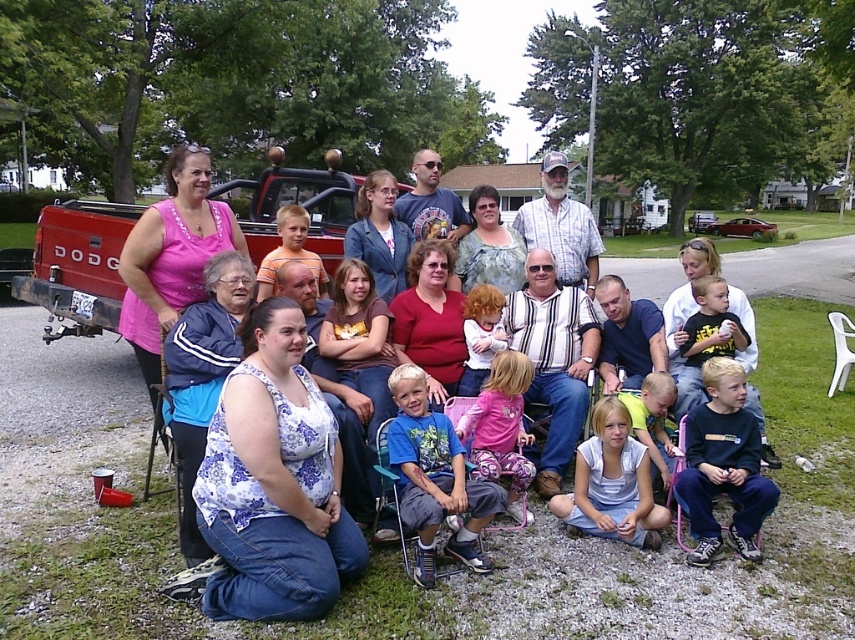
You are at a family gathering and want to greet two people wearing the floral fabric dress at center and the white cotton shirt at center. Which one should you approach first if you want to start with the person on the left?

You should approach the floral fabric dress at center first because it is positioned to the left of the white cotton shirt at center.